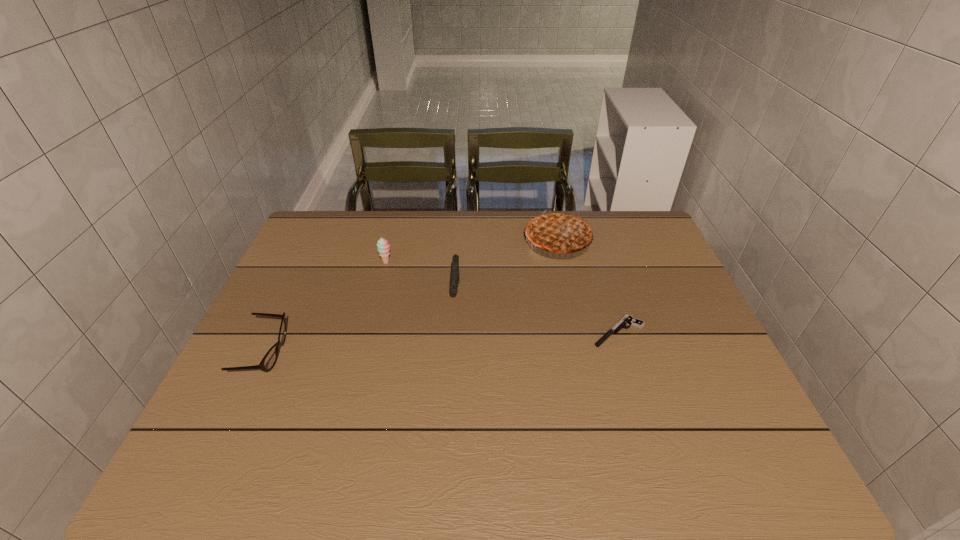
This screenshot has width=960, height=540. I want to click on pie, so click(x=558, y=232).

This screenshot has width=960, height=540. What are the coordinates of `the second object from left to right` in the screenshot? It's located at (383, 247).

You are a GUI agent. You are given a task and a screenshot of the screen. Output one action in this format:
    pyautogui.click(x=<x>, y=<y>)
    Task: Click on the third nearest object
    
    Given the screenshot: What is the action you would take?
    pyautogui.click(x=455, y=261)

This screenshot has height=540, width=960. What are the coordinates of `the taller pistol` in the screenshot? It's located at (455, 261).

I want to click on the second shortest object, so click(x=269, y=360).

Where is `spectacles`? spectacles is located at coordinates (269, 360).

Identify the location of the right pistol. The height and width of the screenshot is (540, 960). pyautogui.click(x=627, y=319).

Identify the location of the shorter pistol. The image size is (960, 540). (627, 319).

You are a GUI agent. You are given a task and a screenshot of the screen. Output one action in this format:
    pyautogui.click(x=<x>, y=<y>)
    Task: Click on the vacant space situated on the right of the pie
    
    Given the screenshot: What is the action you would take?
    pyautogui.click(x=629, y=240)

Image resolution: width=960 pixels, height=540 pixels. Find the location of `vacant position located on the right of the sherbert`. vacant position located on the right of the sherbert is located at coordinates (478, 262).